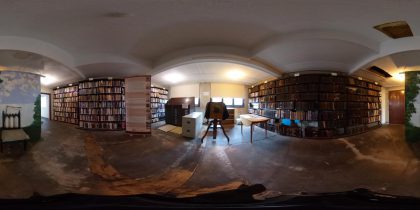
Locate an element on the screen. The height and width of the screenshot is (210, 420). window is located at coordinates (196, 99), (215, 99), (224, 98), (238, 99), (43, 103).